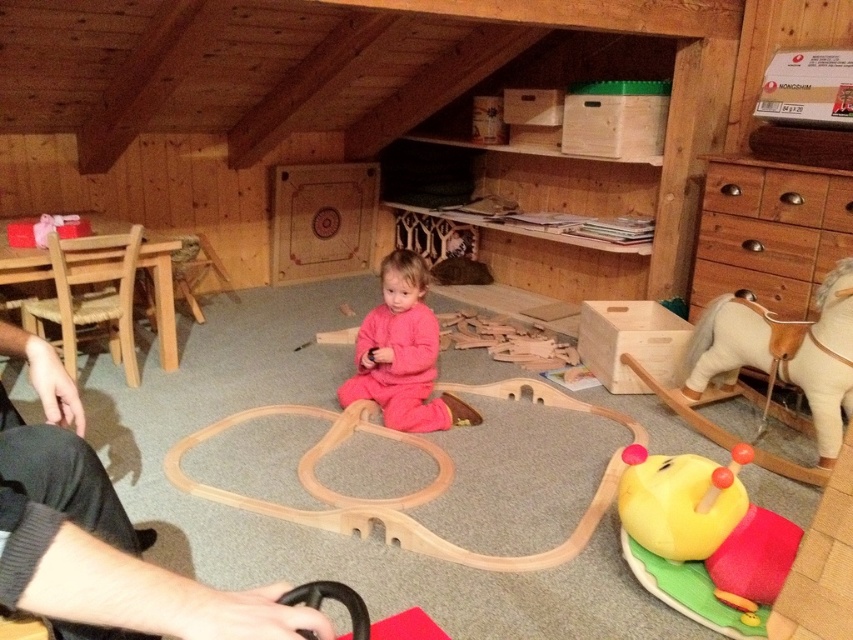
Question: Which point is farther to the camera?

Choices:
 (A) (432, 339)
 (B) (628, 518)

Answer: (A)

Question: Is wooden rocking horse at right bigger than pink fleece baby at center?

Choices:
 (A) yes
 (B) no

Answer: (A)

Question: Which of the following is the closest to the observer?

Choices:
 (A) (67, 388)
 (B) (811, 244)
 (C) (711, 627)

Answer: (A)

Question: Does black fabric at lower left lie in front of pink fleece baby at center?

Choices:
 (A) no
 (B) yes

Answer: (B)

Question: Does yellow fabric snail at lower right have a greater width compared to wooden rocking horse at right?

Choices:
 (A) no
 (B) yes

Answer: (A)

Question: Which of the following is the closest to the observer?

Choices:
 (A) (234, 632)
 (B) (846, 273)
 (C) (401, 387)
 (D) (741, 266)

Answer: (A)